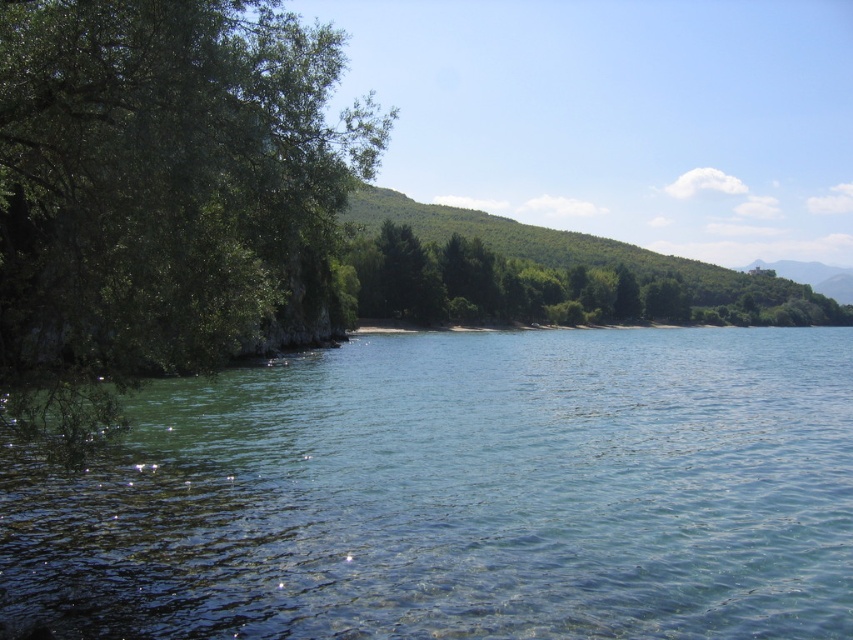
Can you confirm if green leafy tree at left is wider than green leafy trees at center?

Incorrect, green leafy tree at left's width does not surpass green leafy trees at center's.

Does green leafy tree at left have a larger size compared to green leafy trees at center?

No.

Where is `green leafy tree at left`? The image size is (853, 640). green leafy tree at left is located at coordinates (157, 188).

Which is in front, point (711, 332) or point (486, 264)?

Point (486, 264) is in front.

Does clear water at center appear on the right side of green leafy trees at center?

No, clear water at center is not to the right of green leafy trees at center.

Who is more forward, [706,337] or [433,275]?

Positioned in front is point [433,275].

At what (x,y) coordinates should I click in order to perform the action: click on clear water at center. Please return your answer as a coordinate pair (x, y). The height and width of the screenshot is (640, 853). Looking at the image, I should click on (462, 493).

Is point (431, 384) farther from viewer compared to point (83, 8)?

Yes, it is behind point (83, 8).

Who is more distant from viewer, (x=550, y=621) or (x=219, y=200)?

The point (x=550, y=621) is more distant.

Which is in front, point (677, 557) or point (248, 64)?

Positioned in front is point (248, 64).

Locate an element on the screen. clear water at center is located at coordinates 462,493.